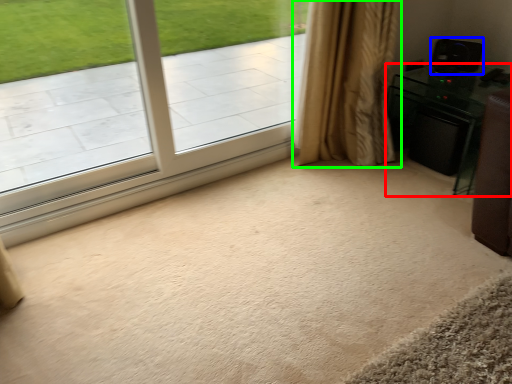
Question: Which is farther away from furniture (highlighted by a red box)? speaker (highlighted by a blue box) or curtain (highlighted by a green box)?

Choices:
 (A) speaker
 (B) curtain

Answer: (B)